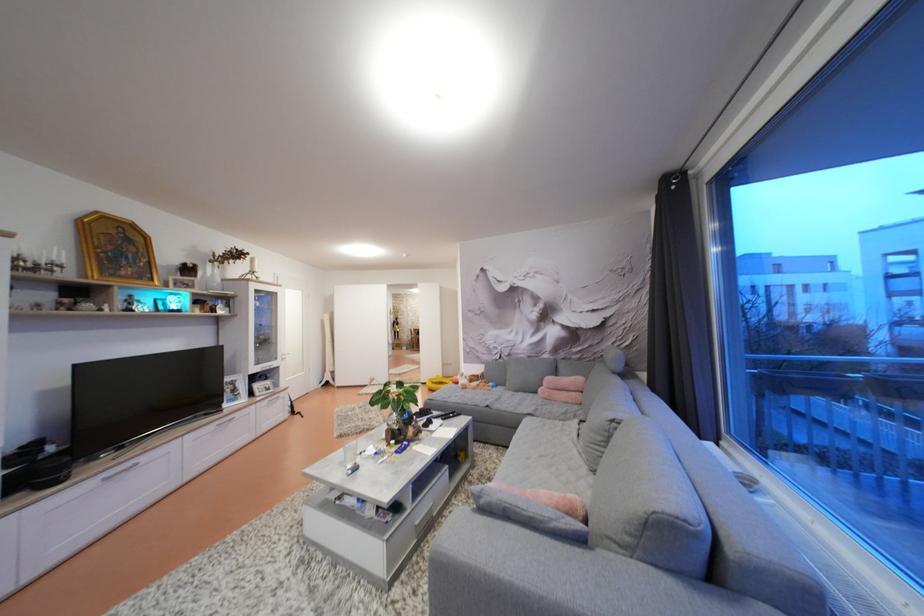
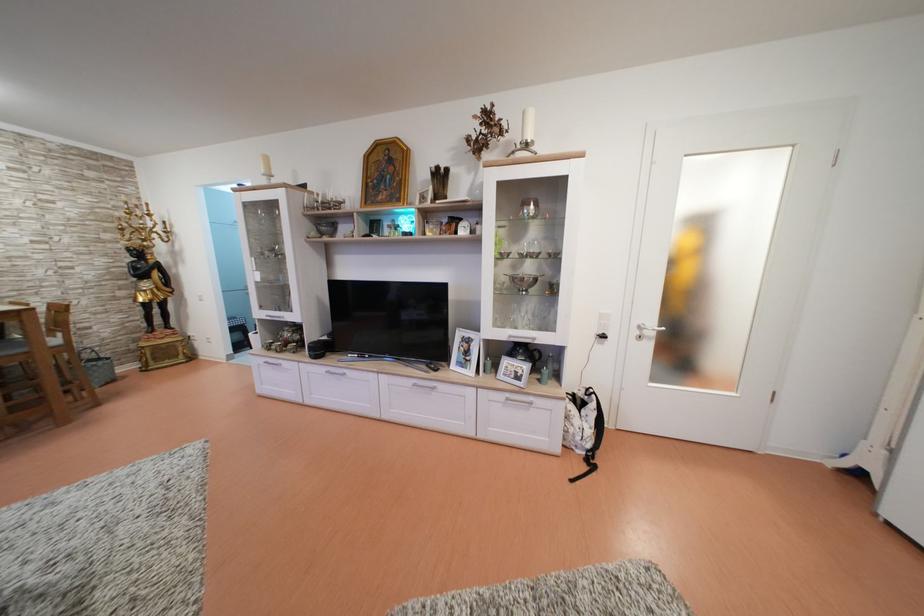
The point at (225,428) is marked in the first image. Where is the corresponding point in the second image?

(422, 387)